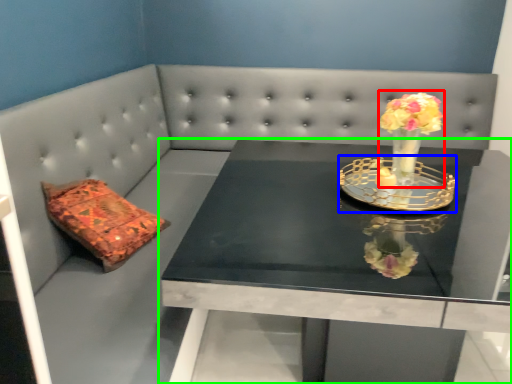
Question: Estimate the real-world distances between objects in this image. Which object is farther from floral arrangement (highlighted by a red box), candle holder (highlighted by a blue box) or table (highlighted by a green box)?

Choices:
 (A) candle holder
 (B) table

Answer: (B)